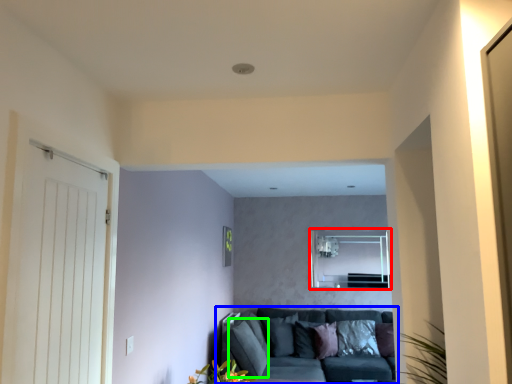
Question: Which object is positioned farthest from window (highlighted by a red box)? Select from studio couch (highlighted by a blue box) and pillow (highlighted by a green box).

Choices:
 (A) studio couch
 (B) pillow

Answer: (B)